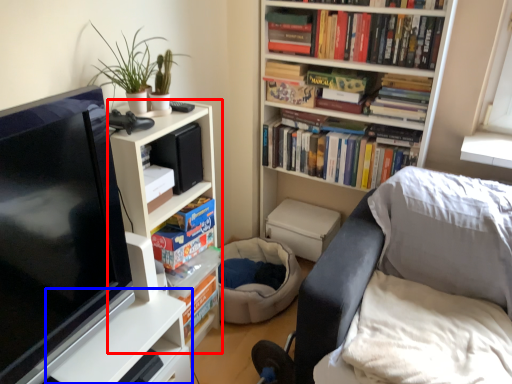
Question: Among these objects, which one is nearest to the camera, bookcase (highlighted by a red box) or table (highlighted by a blue box)?

Choices:
 (A) bookcase
 (B) table

Answer: (B)